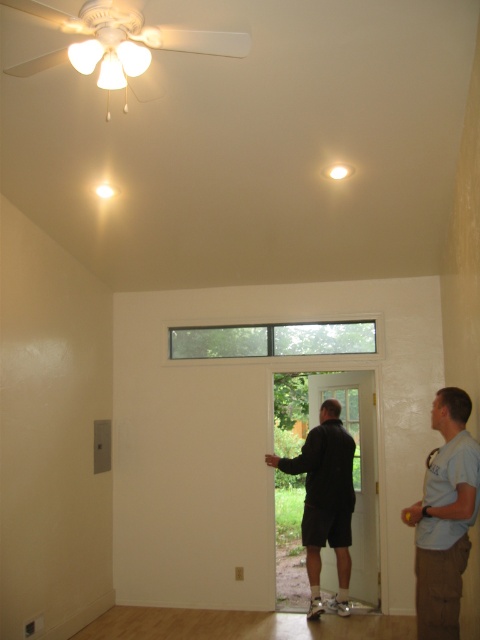
Is light blue t-shirt at right thinner than clear glass window at center?

Correct, light blue t-shirt at right's width is less than clear glass window at center's.

Does light blue t-shirt at right appear under clear glass window at center?

Correct, light blue t-shirt at right is located below clear glass window at center.

Which is behind, point (458, 486) or point (302, 342)?

The point (302, 342) is more distant.

Locate an element on the screen. This screenshot has height=640, width=480. light blue t-shirt at right is located at coordinates (444, 516).

Does point (321, 476) lie in front of point (202, 339)?

Yes, it is in front of point (202, 339).

Which is behind, point (345, 548) or point (335, 353)?

The point (335, 353) is more distant.

At what (x,y) coordinates should I click in order to perform the action: click on dark gray shorts at center. Please return your answer as a coordinate pair (x, y). Image resolution: width=480 pixels, height=640 pixels. Looking at the image, I should click on (324, 500).

Is point (432, 572) positioned behind point (334, 604)?

No, (432, 572) is closer to viewer.

Can you confirm if light blue t-shirt at right is thinner than dark gray shorts at center?

Indeed, light blue t-shirt at right has a lesser width compared to dark gray shorts at center.

Is point (457, 609) more distant than point (308, 509)?

No, (457, 609) is in front of (308, 509).

You are a GUI agent. You are given a task and a screenshot of the screen. Output one action in this format:
    pyautogui.click(x=<x>, y=<y>)
    Task: Click on the light blue t-shirt at right
    
    Given the screenshot: What is the action you would take?
    pyautogui.click(x=444, y=516)